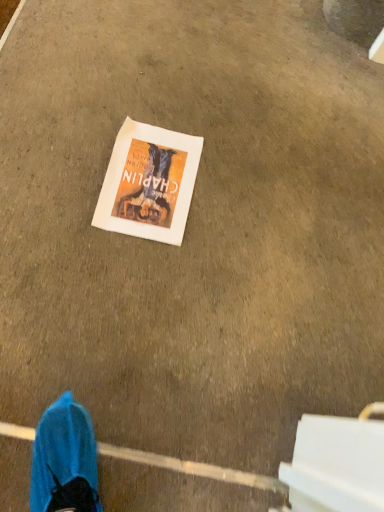
Where is `free space above matte paper book cover at center (from a real-world perspective)`? This screenshot has width=384, height=512. free space above matte paper book cover at center (from a real-world perspective) is located at coordinates [x=148, y=176].